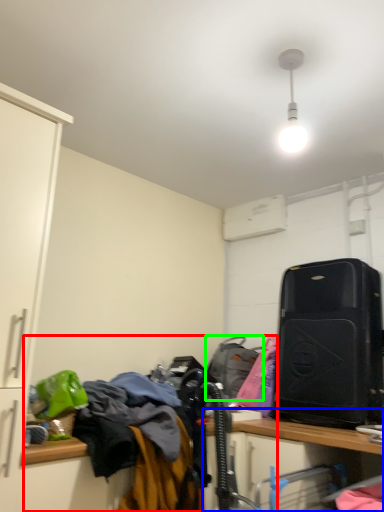
Question: Which object is the closest to the laundry (highlighted by a red box)? Choose among these: computer desk (highlighted by a blue box) or luggage and bags (highlighted by a green box).

Choices:
 (A) computer desk
 (B) luggage and bags

Answer: (B)